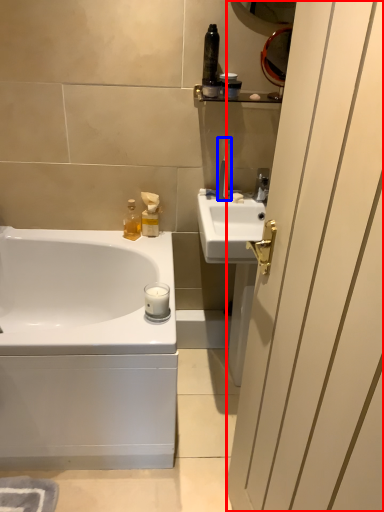
Question: Which of the following is the farthest to the observer, screen door (highlighted by a red box) or toothbrush (highlighted by a blue box)?

Choices:
 (A) screen door
 (B) toothbrush

Answer: (B)